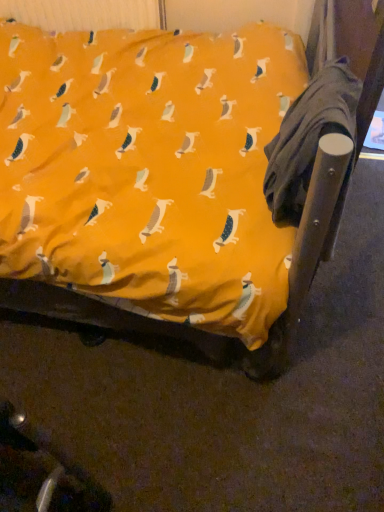
What do you see at coordinates (41, 472) in the screenshot? I see `metallic silver swivel chair at lower left` at bounding box center [41, 472].

What is the approximate height of metallic silver swivel chair at lower left?

metallic silver swivel chair at lower left is 16.14 inches in height.

You are a GUI agent. You are given a task and a screenshot of the screen. Output one action in this format:
    pyautogui.click(x=<x>, y=<y>)
    Task: Click on the metallic silver swivel chair at lower left
    
    Given the screenshot: What is the action you would take?
    pyautogui.click(x=41, y=472)

In order to click on metallic silver swivel chair at lower left in this screenshot , I will do `click(41, 472)`.